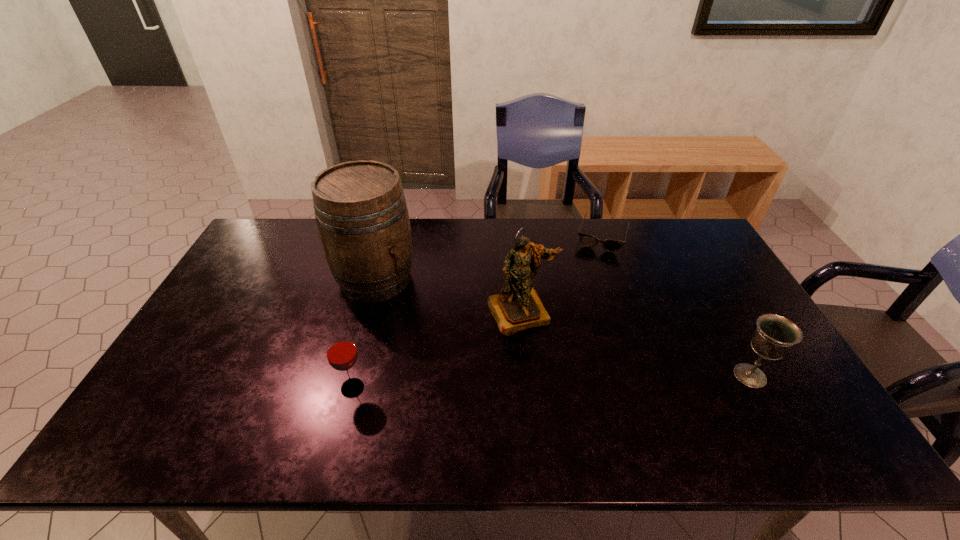
At what (x,y) coordinates should I click in order to perform the action: click on vacant space on the desktop that is between the glass and the rightmost object and is positioned on the side of the tallest object near the bung hole. Please return your answer as a coordinate pair (x, y). This screenshot has width=960, height=540. Looking at the image, I should click on (507, 383).

You are a GUI agent. You are given a task and a screenshot of the screen. Output one action in this format:
    pyautogui.click(x=<x>, y=<y>)
    Task: Click on the vacant spot on the desktop that is between the glass and the chalice and is positioned on the front lenses of the shortest object
    The height and width of the screenshot is (540, 960).
    Given the screenshot: What is the action you would take?
    pyautogui.click(x=561, y=381)

The width and height of the screenshot is (960, 540). Find the location of `vacant spot on the desktop that is between the glass and the chalice and is positioned on the front-facing side of the fourth shortest object`. vacant spot on the desktop that is between the glass and the chalice and is positioned on the front-facing side of the fourth shortest object is located at coordinates (554, 382).